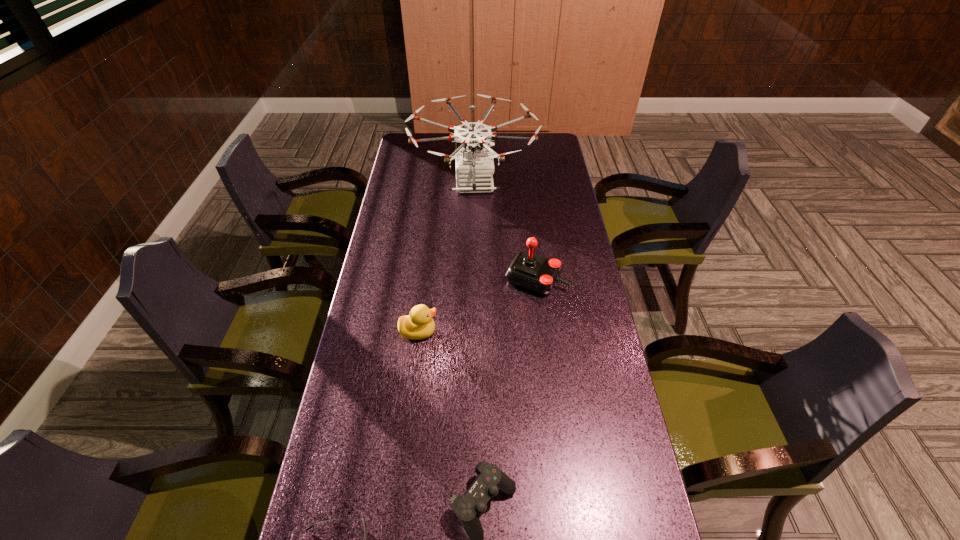
You are a GUI agent. You are given a task and a screenshot of the screen. Output one action in this format:
    pyautogui.click(x=<x>, y=<y>)
    Task: Click on the drone located at the left edge
    This screenshot has width=960, height=540.
    Given the screenshot: What is the action you would take?
    pyautogui.click(x=474, y=167)

Identify the location of duckling located in the left edge section of the desktop. This screenshot has width=960, height=540. (419, 324).

You are a GUI agent. You are given a task and a screenshot of the screen. Output one action in this format:
    pyautogui.click(x=<x>, y=<y>)
    Task: Click on the drone that is at the right edge
    This screenshot has height=540, width=960.
    Given the screenshot: What is the action you would take?
    pyautogui.click(x=474, y=167)

Locate an element on the screen. The height and width of the screenshot is (540, 960). joystick located in the right edge section of the desktop is located at coordinates (532, 272).

Locate an element on the screen. object present at the far left corner is located at coordinates (474, 167).

You are a GUI agent. You are given a task and a screenshot of the screen. Output one action in this format:
    pyautogui.click(x=<x>, y=<y>)
    Task: Click on the object at the far right corner
    The width and height of the screenshot is (960, 540).
    Given the screenshot: What is the action you would take?
    pyautogui.click(x=474, y=167)

In the image, there is a desktop. Where is `vacant space at the left edge`? This screenshot has width=960, height=540. vacant space at the left edge is located at coordinates (413, 262).

Find the location of a particular element. The height and width of the screenshot is (540, 960). vacant region at the right edge is located at coordinates (540, 255).

Locate an element on the screen. The height and width of the screenshot is (540, 960). vacant space at the far left corner of the desktop is located at coordinates (406, 134).

This screenshot has width=960, height=540. Identify the location of free point between the farthest object and the fourth shortest object. click(x=505, y=232).